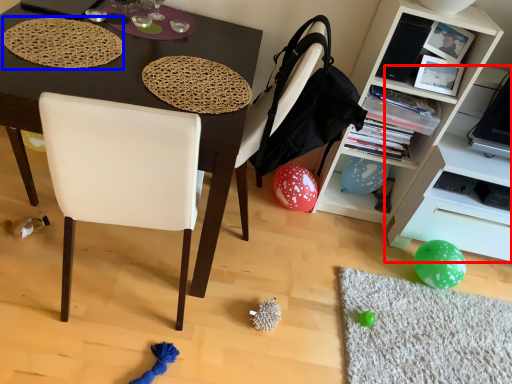
Question: Which point is further to the camera, shelf (highlighted by a red box) or mat (highlighted by a blue box)?

Choices:
 (A) shelf
 (B) mat

Answer: (A)